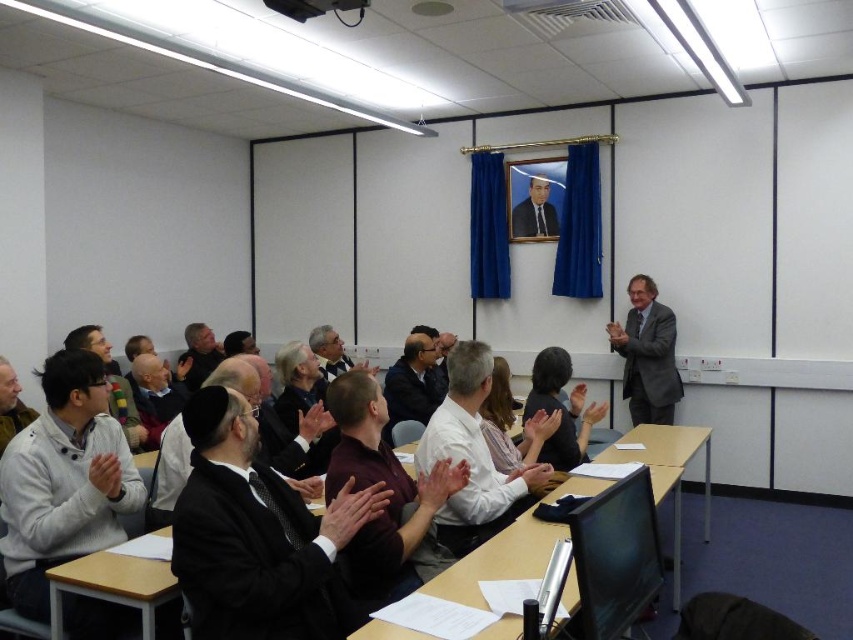
Describe the element at coordinates (392, 493) in the screenshot. I see `maroon fabric shirt at center` at that location.

Between point (393, 538) and point (416, 467), which one is positioned in front?

Point (393, 538) is more forward.

Which is in front, point (368, 531) or point (505, 477)?

Point (368, 531) is more forward.

Locate an element on the screen. maroon fabric shirt at center is located at coordinates (392, 493).

Consider the image. Which of these two, gray suit at right or dark brown suit at center, stands shorter?

Standing shorter between the two is dark brown suit at center.

Can you confirm if gray suit at right is positioned below dark brown suit at center?

Actually, gray suit at right is above dark brown suit at center.

Locate an element on the screen. Image resolution: width=853 pixels, height=640 pixels. gray suit at right is located at coordinates (647, 355).

Image resolution: width=853 pixels, height=640 pixels. What do you see at coordinates (199, 355) in the screenshot?
I see `dark gray suit at center` at bounding box center [199, 355].

This screenshot has height=640, width=853. I want to click on dark gray suit at center, so click(x=199, y=355).

Does point (202, 364) lie in front of point (323, 372)?

No, (202, 364) is behind (323, 372).

Image resolution: width=853 pixels, height=640 pixels. What are the coordinates of `dark gray suit at center` in the screenshot? It's located at (199, 355).